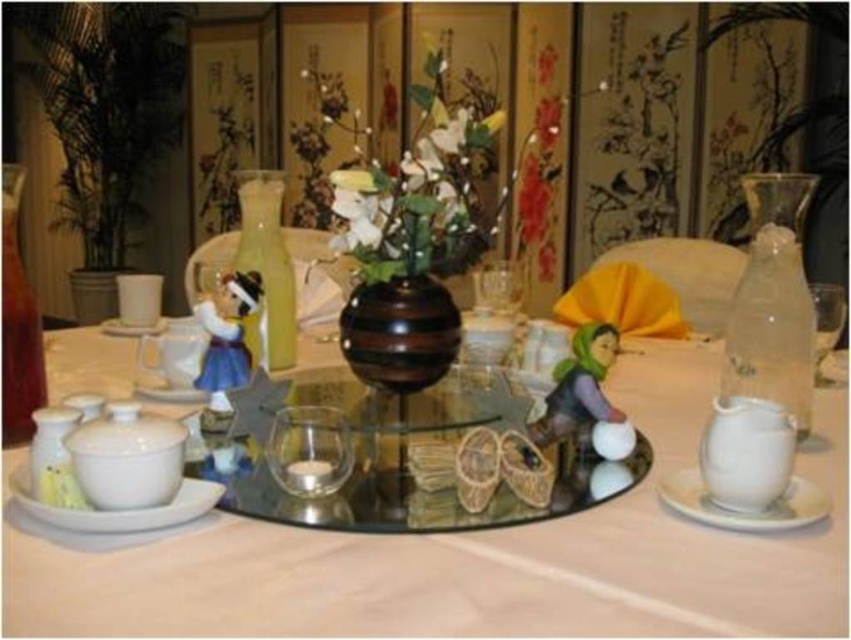
Question: Among these objects, which one is farthest from the camera?

Choices:
 (A) brown striped vase at center
 (B) white glossy tea pot at lower right

Answer: (A)

Question: Is matte glass centerpiece at center wider than white ceramic saucer at center?

Choices:
 (A) yes
 (B) no

Answer: (A)

Question: Where is clear glass bottle at right located in relation to brown striped vase at center in the image?

Choices:
 (A) above
 (B) below

Answer: (B)

Question: Based on their relative distances, which object is nearer to the matte glass centerpiece at center?

Choices:
 (A) white glossy tea pot at lower right
 (B) white matte saucer at lower left
 (C) white ceramic saucer at center
 (D) brown striped vase at center

Answer: (A)

Question: Which object is farther from the camera taking this photo?

Choices:
 (A) clear glass bottle at right
 (B) white glossy tea pot at lower right

Answer: (A)

Question: In this image, where is clear glass bottle at right located relative to white ceramic saucer at center?

Choices:
 (A) below
 (B) above

Answer: (A)